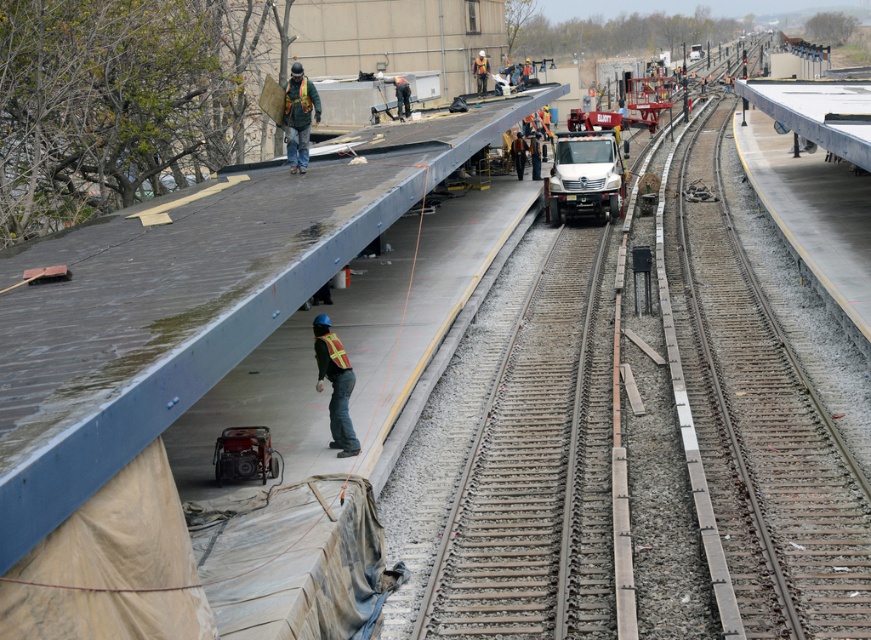
You are a safety inspector checking the construction site. You notice the smooth steel tracks at center and the yellow reflective vest at center. Which object is placed higher in the scene?

The smooth steel tracks at center are positioned over the yellow reflective vest at center, so the tracks are higher than the vest.

You are a safety inspector checking the construction site. You notice the smooth steel tracks at center and the yellow reflective vest at center. Which object is bigger in size?

The smooth steel tracks at center has a larger size compared to the yellow reflective vest at center.

You are a construction worker standing at the entrance of the construction site. You need to locate the smooth steel tracks at center. According to the coordinates provided, where exactly should you look to find them?

The smooth steel tracks at center are located at the coordinates point (761, 428).